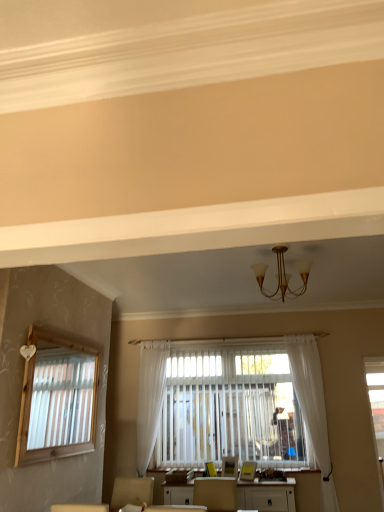
Question: Is white glossy table at center shorter than gold metallic chandelier at center?

Choices:
 (A) no
 (B) yes

Answer: (B)

Question: From the image's perspective, is white glossy table at center below gold metallic chandelier at center?

Choices:
 (A) yes
 (B) no

Answer: (A)

Question: From a real-world perspective, is white glossy table at center on top of gold metallic chandelier at center?

Choices:
 (A) no
 (B) yes

Answer: (A)

Question: Is white glossy table at center to the left of gold metallic chandelier at center from the viewer's perspective?

Choices:
 (A) yes
 (B) no

Answer: (A)

Question: Can you confirm if white glossy table at center is taller than gold metallic chandelier at center?

Choices:
 (A) no
 (B) yes

Answer: (A)

Question: Does white glossy table at center come in front of gold metallic chandelier at center?

Choices:
 (A) no
 (B) yes

Answer: (A)

Question: Does gold metallic chandelier at center contain white sheer curtain at center, which is the 2th curtain from right to left?

Choices:
 (A) no
 (B) yes

Answer: (A)

Question: Does gold metallic chandelier at center lie in front of white sheer curtain at center, marked as the 1th curtain in a left-to-right arrangement?

Choices:
 (A) no
 (B) yes

Answer: (B)

Question: Can you confirm if gold metallic chandelier at center is positioned to the left of white sheer curtain at center, which is the 2th curtain from right to left?

Choices:
 (A) no
 (B) yes

Answer: (A)

Question: Is gold metallic chandelier at center smaller than white sheer curtain at center, which is the 2th curtain from right to left?

Choices:
 (A) no
 (B) yes

Answer: (B)

Question: From a real-world perspective, is gold metallic chandelier at center physically above white sheer curtain at center, which is the 2th curtain from right to left?

Choices:
 (A) yes
 (B) no

Answer: (A)

Question: Does gold metallic chandelier at center lie behind white sheer curtain at center, marked as the 1th curtain in a left-to-right arrangement?

Choices:
 (A) yes
 (B) no

Answer: (B)

Question: Are white sheer curtain at center, marked as the 1th curtain in a left-to-right arrangement, and gold metallic chandelier at center located far from each other?

Choices:
 (A) yes
 (B) no

Answer: (A)